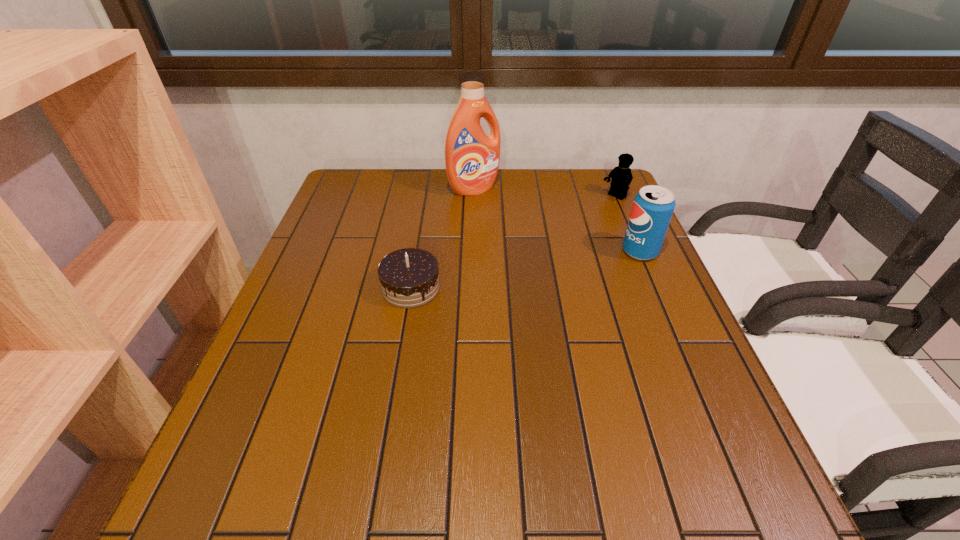
Find the location of a particular element. The image size is (960, 540). the shortest object is located at coordinates (409, 278).

Where is `the nearest object`? the nearest object is located at coordinates (409, 278).

This screenshot has width=960, height=540. Find the location of `the second tallest object`. the second tallest object is located at coordinates (653, 206).

I want to click on the third farthest object, so click(653, 206).

Where is `the third tallest object`? The image size is (960, 540). the third tallest object is located at coordinates (x=621, y=176).

This screenshot has width=960, height=540. Find the location of `detergent`. detergent is located at coordinates (472, 158).

This screenshot has width=960, height=540. What are the coordinates of `vacant space located 0.280m on the back of the nearest object` in the screenshot? It's located at (424, 207).

Where is `free location located on the front of the third shortest object`? free location located on the front of the third shortest object is located at coordinates (676, 336).

Locate an element on the screen. This screenshot has height=540, width=960. vacant area situated 0.240m on the front-facing side of the third tallest object is located at coordinates (558, 236).

Where is `vacant region located 0.190m on the front-facing side of the third tallest object`? The width and height of the screenshot is (960, 540). vacant region located 0.190m on the front-facing side of the third tallest object is located at coordinates (569, 228).